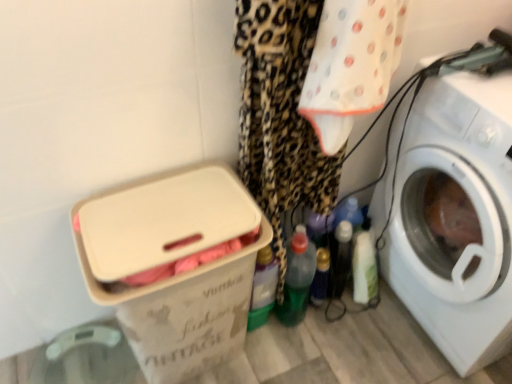
I want to click on free space in front of translucent plastic bottle at center, which is the 1th bottle in right-to-left order, so pos(324,341).